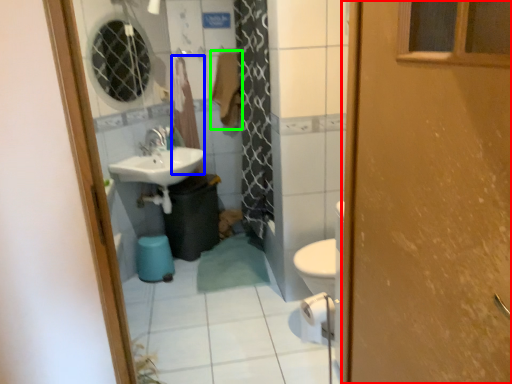
Question: Which object is positioned farthest from door (highlighted by a red box)? Select from curtain (highlighted by a blue box) and laundry (highlighted by a green box).

Choices:
 (A) curtain
 (B) laundry

Answer: (A)